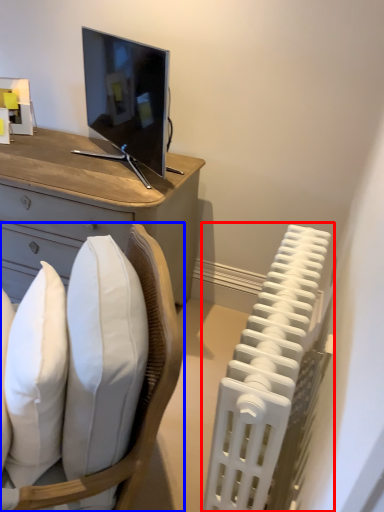
Question: Among these objects, which one is nearest to the camera, radiator (highlighted by a red box) or chair (highlighted by a blue box)?

Choices:
 (A) radiator
 (B) chair

Answer: (B)